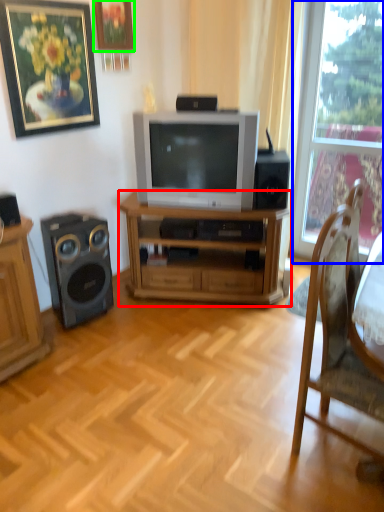
Question: Considering the real-world distances, which object is closest to desk (highlighted by a red box)? window (highlighted by a blue box) or picture frame (highlighted by a green box).

Choices:
 (A) window
 (B) picture frame

Answer: (A)